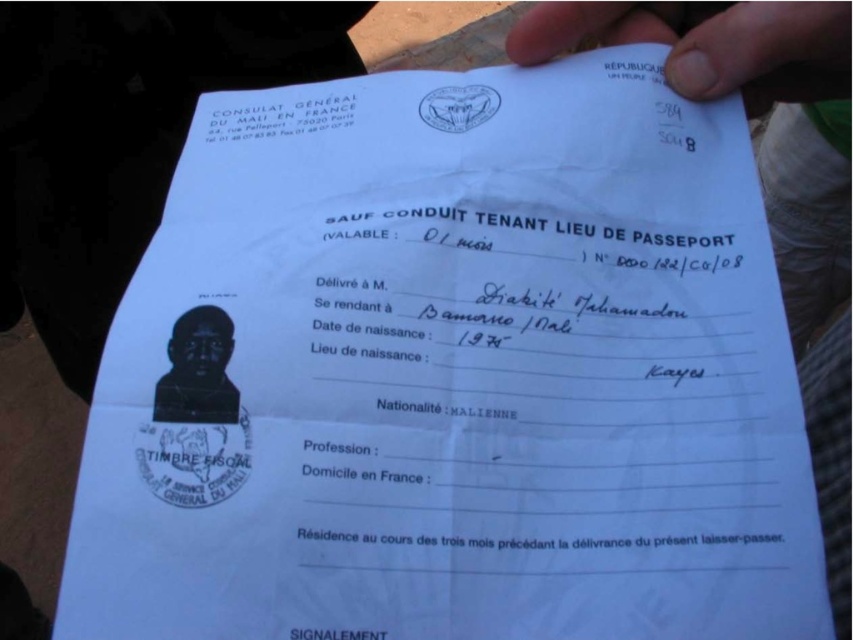
You are a passport control officer examining this document. You notice the white paper at upper center and the black matte passport photo at center. Which object is positioned higher on the document?

The white paper at upper center is positioned higher on the document than the black matte passport photo at center.

What is the location of the point with coordinates (708,44) on the document?

The point with coordinates (708,44) is located on the white paper at upper center.

Based on the scene description, where is the white paper at upper center located in relation to the black matte passport photo at center?

The white paper at upper center is located to the right of the black matte passport photo at center.